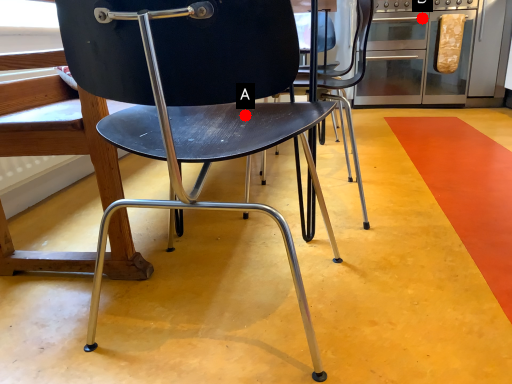
Question: Two points are circled on the image, labeled by A and B beside each circle. Which of the following is the closest to the observer?

Choices:
 (A) A is closer
 (B) B is closer

Answer: (A)